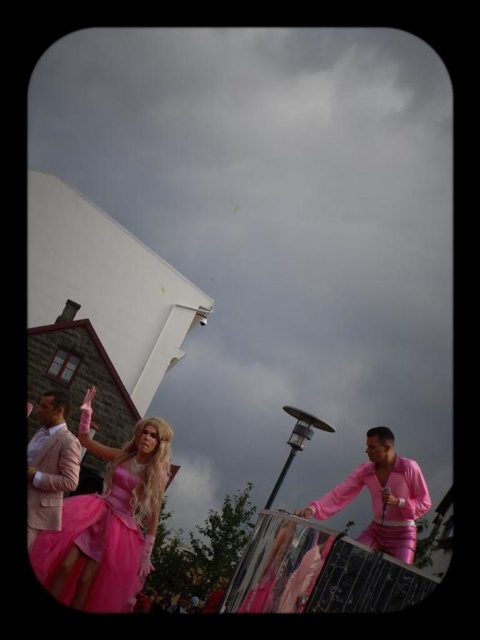
You are a photographer at a fashion event. You need to capture a photo of the pink satin dress at lower center and the matte pink suit at left. The camera frame can only accommodate one of them if you focus on the larger object. Which one should you focus on to ensure it fits properly?

The pink satin dress at lower center is larger in size than the matte pink suit at left, so you should focus on the pink satin dress at lower center to ensure it fits properly in the camera frame.

You are standing at the origin point of the coordinate system in this image. You want to walk towards the point at the bottom right corner of the image. Which point, point (410, 493) or point (54, 461), is closer to your path?

Point (54, 461) is closer to your path because it is located lower on the y axis and closer to the bottom right corner of the image compared to point (410, 493).